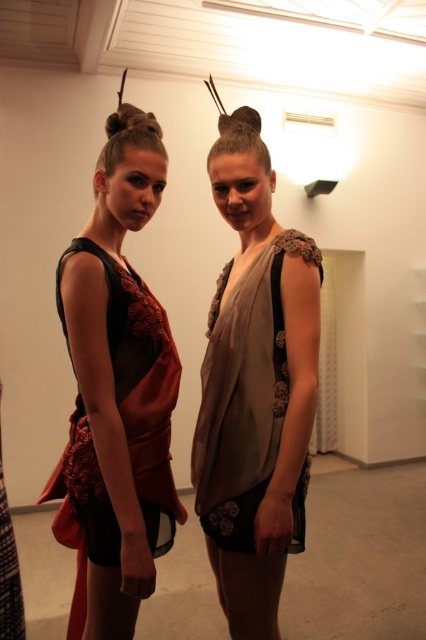
You are a fashion designer trying to decide which dress to showcase in a runway show. Both the matte red fabric dress at center and the matte beige dress at center are options. Based on their sizes, which dress would require more fabric to create?

The matte red fabric dress at center requires more fabric because it is larger in size than the matte beige dress at center.

You are a fashion designer observing two dresses displayed in the center of the image. The matte red fabric dress at center has floral patterns. The matte beige dress at center is a solid color. Which dress has a greater width when viewed from the front?

The matte red fabric dress at center might be wider than matte beige dress at center, so the matte red fabric dress at center could have a greater width when viewed from the front.

You are a fashion designer observing two dresses displayed in the center of the room. The dresses are the matte red fabric dress at center and the matte beige dress at center. Which dress is taller?

The matte red fabric dress at center is much taller than the matte beige dress at center.